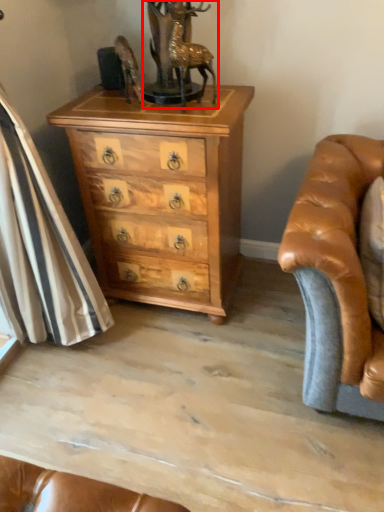
Question: From the image's perspective, what is the correct spatial positioning of antique (annotated by the red box) in reference to chest of drawers?

Choices:
 (A) below
 (B) above

Answer: (B)